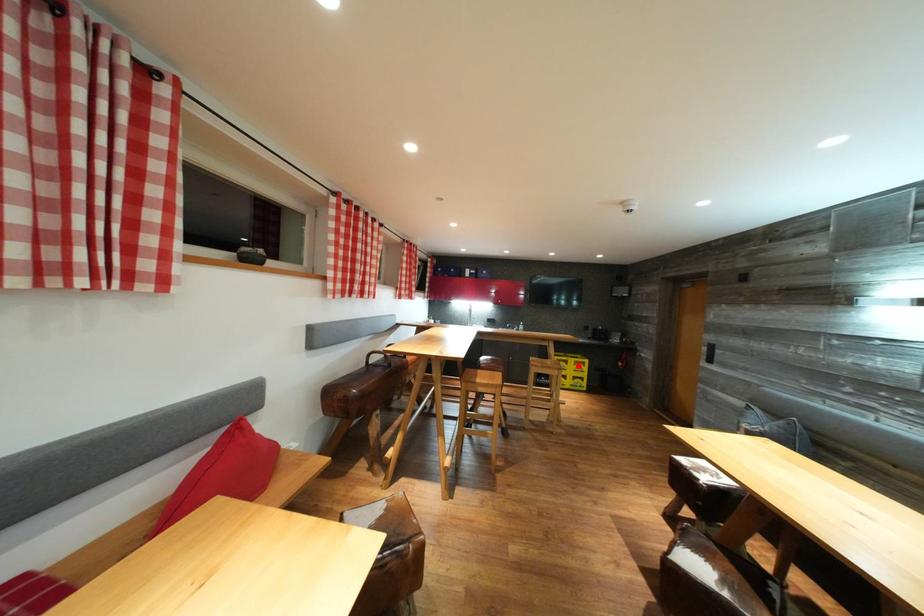
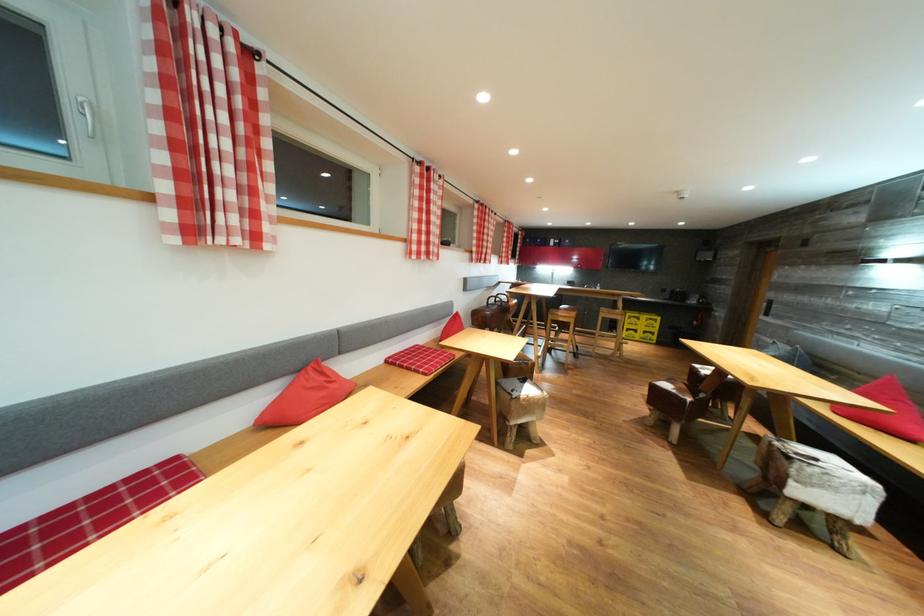
In the second image, find the point that corresponds to the highlighted location in the first image.

(650, 323)